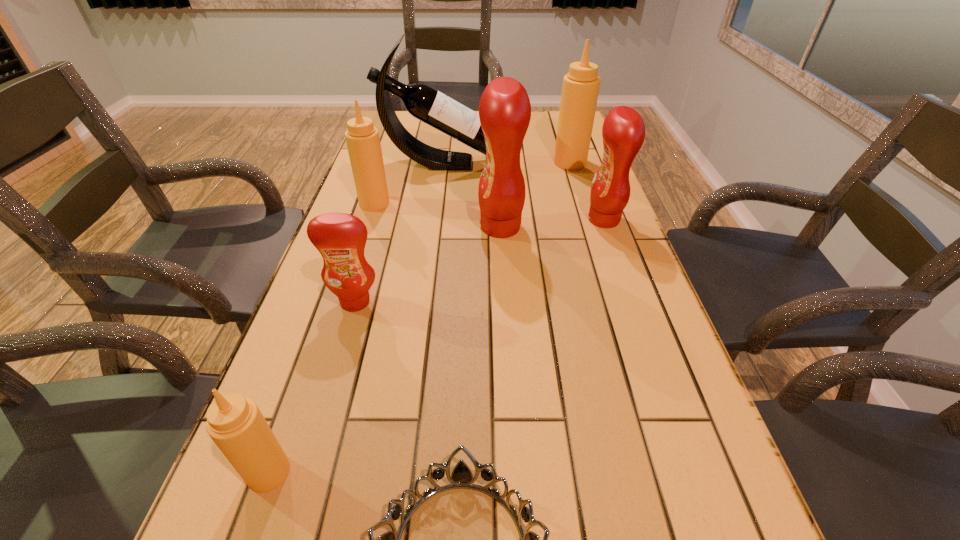
Where is `vacant area that lies between the biggest red condiment and the rightmost red condiment`? vacant area that lies between the biggest red condiment and the rightmost red condiment is located at coordinates (552, 223).

You are a GUI agent. You are given a task and a screenshot of the screen. Output one action in this format:
    pyautogui.click(x=<x>, y=<y>)
    Task: Click on the object that stands as the fifth closest to the wine bottle
    
    Given the screenshot: What is the action you would take?
    pyautogui.click(x=340, y=238)

I want to click on object that ranks as the fifth closest to the second biggest red condiment, so click(x=363, y=142).

Find the location of a particular element. The image size is (960, 540). condiment that is the third nearest to the rightmost red condiment is located at coordinates (340, 238).

Locate which condiment is the second closest to the farthest condiment. Please provide its 2D coordinates. Your answer should be formatted as a tuple, i.e. [(x, y)], where the tuple contains the x and y coordinates of a point satisfying the conditions above.

[(504, 110)]

Find the location of `red condiment that is the closest to the third nearest object`. red condiment that is the closest to the third nearest object is located at coordinates tap(504, 110).

Locate which red condiment is the closest to the biggest tan condiment. Please provide its 2D coordinates. Your answer should be formatted as a tuple, i.e. [(x, y)], where the tuple contains the x and y coordinates of a point satisfying the conditions above.

[(623, 132)]

Point out which tan condiment is positioned as the second nearest to the rightmost tan condiment. Please provide its 2D coordinates. Your answer should be formatted as a tuple, i.e. [(x, y)], where the tuple contains the x and y coordinates of a point satisfying the conditions above.

[(236, 425)]

You are a GUI agent. You are given a task and a screenshot of the screen. Output one action in this format:
    pyautogui.click(x=<x>, y=<y>)
    Task: Click on the tan condiment that is the closest one to the nearest red condiment
    Image resolution: width=960 pixels, height=540 pixels.
    Given the screenshot: What is the action you would take?
    pyautogui.click(x=236, y=425)

Where is `vacant area in the image that satisfies the following two spatial constraints: 1. on the stand of the wine bottle; 2. on the label side of the nearest red condiment`? Image resolution: width=960 pixels, height=540 pixels. vacant area in the image that satisfies the following two spatial constraints: 1. on the stand of the wine bottle; 2. on the label side of the nearest red condiment is located at coordinates (424, 302).